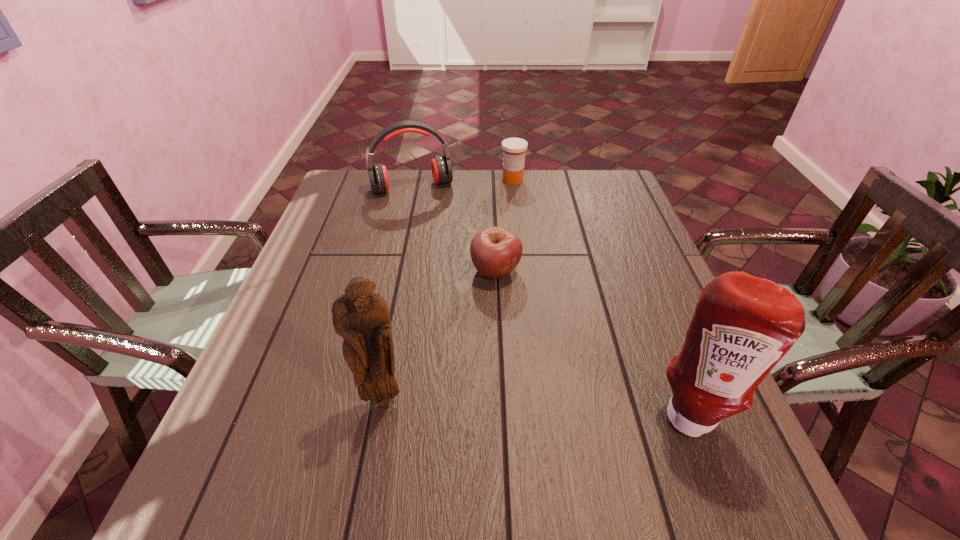
Find the location of a particular element. This screenshot has width=960, height=540. figurine is located at coordinates (361, 317).

Where is `condiment`? The width and height of the screenshot is (960, 540). condiment is located at coordinates (743, 325).

Image resolution: width=960 pixels, height=540 pixels. In order to click on the third nearest object in this screenshot , I will do `click(495, 252)`.

I want to click on apple, so click(x=495, y=252).

At what (x,y) coordinates should I click in order to perform the action: click on medicine. Please return your answer as a coordinate pair (x, y). Looking at the image, I should click on (514, 149).

The height and width of the screenshot is (540, 960). Identify the location of the third tallest object. (441, 167).

The image size is (960, 540). In order to click on vacant space situated on the front-facing side of the figurine in this screenshot , I will do `click(375, 442)`.

Identify the location of blank area located on the left of the condiment. The image size is (960, 540). (558, 413).

This screenshot has height=540, width=960. I want to click on vacant space situated on the side of the third farthest object with the unique marking, so click(x=523, y=337).

I want to click on free location located on the side of the third farthest object with the unique marking, so click(555, 414).